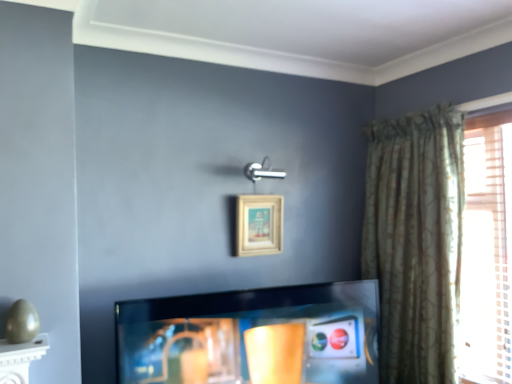
Question: Is green textured curtain at right closer to camera compared to shiny black tv at center?

Choices:
 (A) yes
 (B) no

Answer: (B)

Question: From a real-world perspective, is green textured curtain at right physically above shiny black tv at center?

Choices:
 (A) no
 (B) yes

Answer: (B)

Question: From the image's perspective, is green textured curtain at right located beneath shiny black tv at center?

Choices:
 (A) yes
 (B) no

Answer: (B)

Question: Considering the relative sizes of green textured curtain at right and shiny black tv at center in the image provided, is green textured curtain at right wider than shiny black tv at center?

Choices:
 (A) yes
 (B) no

Answer: (A)

Question: Considering the relative sizes of green textured curtain at right and shiny black tv at center in the image provided, is green textured curtain at right bigger than shiny black tv at center?

Choices:
 (A) no
 (B) yes

Answer: (B)

Question: From the image's perspective, is shiny black tv at center above or below beige wooden picture frame at upper center?

Choices:
 (A) above
 (B) below

Answer: (B)

Question: Is shiny black tv at center spatially inside beige wooden picture frame at upper center, or outside of it?

Choices:
 (A) inside
 (B) outside

Answer: (B)

Question: Relative to beige wooden picture frame at upper center, is shiny black tv at center in front or behind?

Choices:
 (A) behind
 (B) front

Answer: (B)

Question: Considering the relative positions of shiny black tv at center and beige wooden picture frame at upper center in the image provided, is shiny black tv at center to the left or to the right of beige wooden picture frame at upper center?

Choices:
 (A) left
 (B) right

Answer: (B)

Question: Considering the positions of beige wooden picture frame at upper center and green textured curtain at right in the image, is beige wooden picture frame at upper center taller or shorter than green textured curtain at right?

Choices:
 (A) tall
 (B) short

Answer: (B)

Question: From the image's perspective, is beige wooden picture frame at upper center located above or below green textured curtain at right?

Choices:
 (A) below
 (B) above

Answer: (B)

Question: Considering their positions, is beige wooden picture frame at upper center located in front of or behind green textured curtain at right?

Choices:
 (A) front
 (B) behind

Answer: (B)

Question: Would you say beige wooden picture frame at upper center is inside or outside green textured curtain at right?

Choices:
 (A) inside
 (B) outside

Answer: (B)

Question: Considering their positions, is shiny black tv at center located in front of or behind green textured curtain at right?

Choices:
 (A) behind
 (B) front

Answer: (B)

Question: Is shiny black tv at center taller or shorter than green textured curtain at right?

Choices:
 (A) tall
 (B) short

Answer: (B)